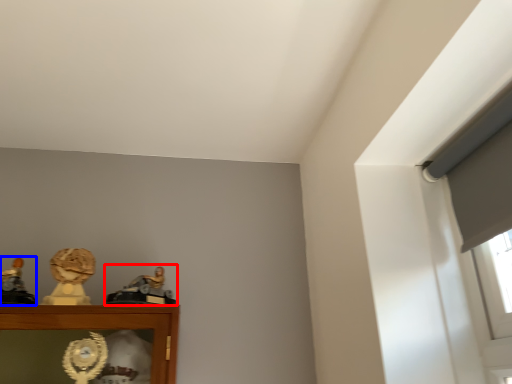
Question: Which of the following is the farthest to the observer, character sculpture (highlighted by a red box) or character sculpture (highlighted by a blue box)?

Choices:
 (A) character sculpture
 (B) character sculpture

Answer: (A)